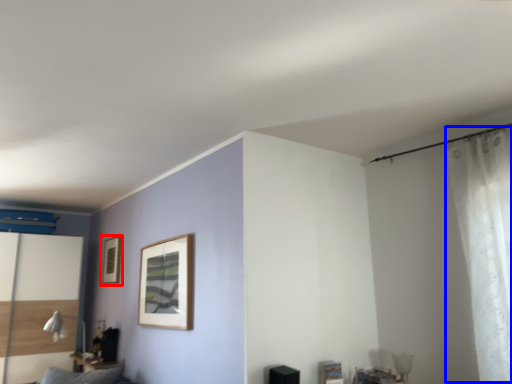
Question: Which point is further to the camera, picture frame (highlighted by a red box) or curtain (highlighted by a blue box)?

Choices:
 (A) picture frame
 (B) curtain

Answer: (A)